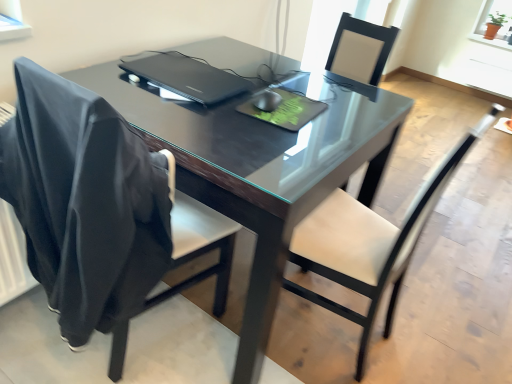
Find the location of a particular element. white leather chair at center, which is the 1th chair from right to left is located at coordinates (370, 244).

Identify the location of black leather chair at left, which is the first chair in left-to-right order. This screenshot has height=384, width=512. pyautogui.click(x=98, y=210).

Identify the location of the 1st chair below the glossy black table at center (from the image's perspective). This screenshot has height=384, width=512. (98, 210).

Is glossy black table at center placed right next to black leather chair at left, which is the first chair in left-to-right order?

There is a gap between glossy black table at center and black leather chair at left, which is the first chair in left-to-right order.

Considering the relative positions of glossy black table at center and black leather chair at left, which is the first chair in left-to-right order, in the image provided, is glossy black table at center behind black leather chair at left, which is the first chair in left-to-right order,?

Yes.

Considering the sizes of white leather chair at center, which is the 1th chair from right to left, and terracotta clay pot at upper right in the image, is white leather chair at center, which is the 1th chair from right to left, taller or shorter than terracotta clay pot at upper right?

Considering their sizes, white leather chair at center, which is the 1th chair from right to left, has more height than terracotta clay pot at upper right.

Looking at the image, does white leather chair at center, which is the 2th chair in left-to-right order, seem bigger or smaller compared to terracotta clay pot at upper right?

Considering their sizes, white leather chair at center, which is the 2th chair in left-to-right order, takes up more space than terracotta clay pot at upper right.

From the image's perspective, is white leather chair at center, which is the 2th chair in left-to-right order, on terracotta clay pot at upper right?

No, from the image's perspective, white leather chair at center, which is the 2th chair in left-to-right order, is not over terracotta clay pot at upper right.

Is white leather chair at center, which is the 1th chair from right to left, aimed at terracotta clay pot at upper right?

No, white leather chair at center, which is the 1th chair from right to left, is not oriented towards terracotta clay pot at upper right.

Is white leather chair at center, which is the 2th chair in left-to-right order, not near black plastic laptop at center?

No, there isn't a large distance between white leather chair at center, which is the 2th chair in left-to-right order, and black plastic laptop at center.

Based on their positions, is white leather chair at center, which is the 1th chair from right to left, located to the left or right of black plastic laptop at center?

Clearly, white leather chair at center, which is the 1th chair from right to left, is on the right of black plastic laptop at center in the image.

From the picture: Is white leather chair at center, which is the 1th chair from right to left, in front of or behind black plastic laptop at center in the image?

white leather chair at center, which is the 1th chair from right to left, is positioned closer to the viewer than black plastic laptop at center.

Does point (437, 195) come behind point (130, 66)?

No, (437, 195) is closer to viewer.

Do you think terracotta clay pot at upper right is within black plastic laptop at center, or outside of it?

terracotta clay pot at upper right exists outside the volume of black plastic laptop at center.

Does terracotta clay pot at upper right have a lesser width compared to black plastic laptop at center?

Indeed, terracotta clay pot at upper right has a lesser width compared to black plastic laptop at center.

From the picture: Is terracotta clay pot at upper right looking in the opposite direction of black plastic laptop at center?

No, terracotta clay pot at upper right's orientation is not away from black plastic laptop at center.

Can you confirm if terracotta clay pot at upper right is bigger than black plastic laptop at center?

Yes, terracotta clay pot at upper right is bigger than black plastic laptop at center.

From a real-world perspective, which object stands above the other?

black leather chair at left, the 2th chair from the right, is physically above.

What's the angular difference between black leather chair at left, which is the first chair in left-to-right order, and glossy black table at center's facing directions?

They differ by 88.3 degrees in their facing directions.

Is black leather chair at left, which is the first chair in left-to-right order, closer to the viewer compared to glossy black table at center?

Yes, black leather chair at left, which is the first chair in left-to-right order, is closer to the viewer.

Would you say terracotta clay pot at upper right is inside or outside black leather chair at left, the 2th chair from the right?

A: terracotta clay pot at upper right cannot be found inside black leather chair at left, the 2th chair from the right.

Based on the photo, from a real-world perspective, is terracotta clay pot at upper right physically located above or below black leather chair at left, which is the first chair in left-to-right order?

From a real-world perspective, terracotta clay pot at upper right is physically above black leather chair at left, which is the first chair in left-to-right order.

In the scene shown: Considering the relative sizes of terracotta clay pot at upper right and black leather chair at left, which is the first chair in left-to-right order, in the image provided, is terracotta clay pot at upper right bigger than black leather chair at left, which is the first chair in left-to-right order,?

Incorrect, terracotta clay pot at upper right is not larger than black leather chair at left, which is the first chair in left-to-right order.

Between terracotta clay pot at upper right and black leather chair at left, the 2th chair from the right, which one has more height?

Standing taller between the two is black leather chair at left, the 2th chair from the right.

Is glossy black table at center completely or partially inside black plastic laptop at center?

That's incorrect, glossy black table at center is not inside black plastic laptop at center.

Can you confirm if black plastic laptop at center is taller than glossy black table at center?

Incorrect, the height of black plastic laptop at center is not larger of that of glossy black table at center.

In order to click on laptop that is above the glossy black table at center (from a real-world perspective) in this screenshot , I will do [x=185, y=76].

In the scene shown: Which is more to the right, black plastic laptop at center or glossy black table at center?

glossy black table at center.

Locate an element on the screen. The height and width of the screenshot is (384, 512). table that is behind the black leather chair at left, which is the first chair in left-to-right order is located at coordinates (259, 172).

Identify the location of window screen lying above the white leather chair at center, which is the 2th chair in left-to-right order (from the image's perspective). (495, 24).

Based on their spatial positions, is glossy black table at center or black plastic laptop at center closer to black leather chair at left, which is the first chair in left-to-right order?

glossy black table at center is closer to black leather chair at left, which is the first chair in left-to-right order.

Looking at the image, which one is located closer to glossy black table at center, black plastic laptop at center or white leather chair at center, which is the 1th chair from right to left?

black plastic laptop at center is positioned closer to the anchor glossy black table at center.

Based on their spatial positions, is glossy black table at center or terracotta clay pot at upper right further from black plastic laptop at center?

Based on the image, terracotta clay pot at upper right appears to be further to black plastic laptop at center.

Estimate the real-world distances between objects in this image. Which object is closer to glossy black table at center, black plastic laptop at center or black leather chair at left, the 2th chair from the right?

black plastic laptop at center is closer to glossy black table at center.

Looking at the image, which one is located closer to white leather chair at center, which is the 2th chair in left-to-right order, glossy black table at center or black plastic laptop at center?

The object closer to white leather chair at center, which is the 2th chair in left-to-right order, is glossy black table at center.

From the image, which object appears to be farther from glossy black table at center, black plastic laptop at center or terracotta clay pot at upper right?

terracotta clay pot at upper right is further to glossy black table at center.

In the scene shown: Which object lies nearer to the anchor point black plastic laptop at center, glossy black table at center or black leather chair at left, the 2th chair from the right?

glossy black table at center is closer to black plastic laptop at center.

Which object lies nearer to the anchor point black plastic laptop at center, terracotta clay pot at upper right or black leather chair at left, the 2th chair from the right?

black leather chair at left, the 2th chair from the right, lies closer to black plastic laptop at center than the other object.

This screenshot has height=384, width=512. I want to click on table located between black leather chair at left, which is the first chair in left-to-right order, and terracotta clay pot at upper right in the depth direction, so point(259,172).

The image size is (512, 384). I want to click on chair between black leather chair at left, the 2th chair from the right, and terracotta clay pot at upper right in the front-back direction, so click(370, 244).

Identify the location of table between black plastic laptop at center and white leather chair at center, which is the 1th chair from right to left. (259, 172).

Locate an element on the screen. This screenshot has height=384, width=512. laptop positioned between white leather chair at center, which is the 2th chair in left-to-right order, and terracotta clay pot at upper right from near to far is located at coordinates click(x=185, y=76).